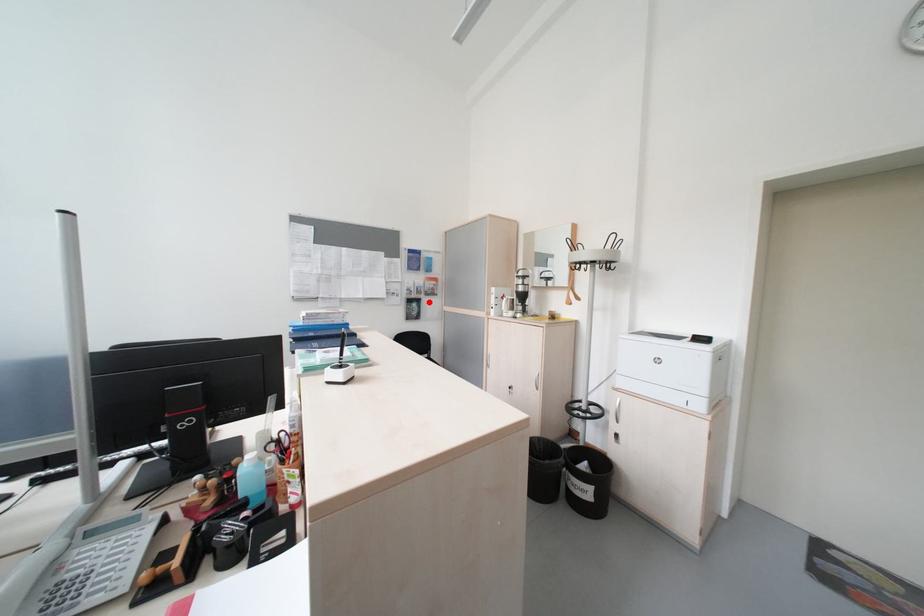
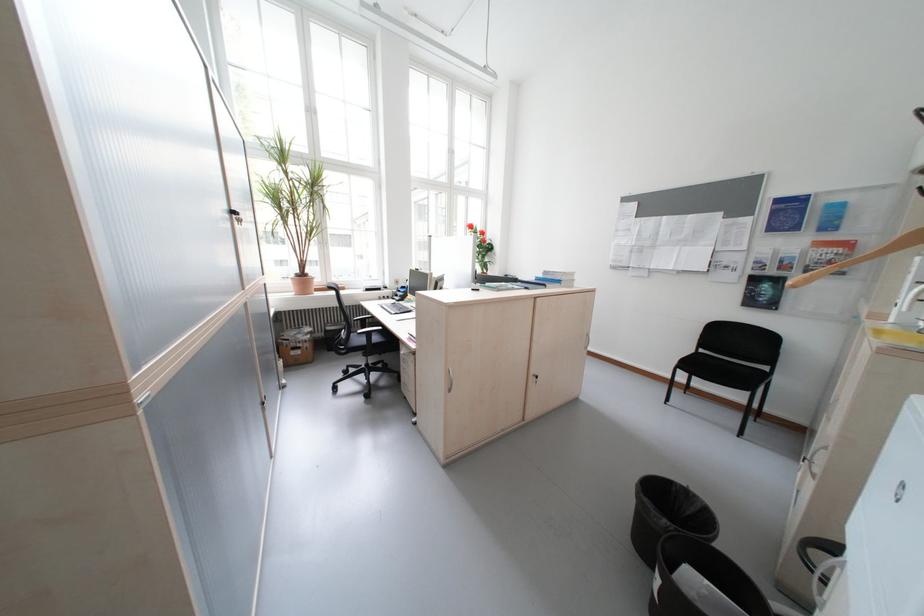
Question: I am providing you with two images of the same scene from different viewpoints. Given a red point in image1, look at the same physical point in image2. Is it:

Choices:
 (A) Closer to the viewpoint
 (B) Farther from the viewpoint

Answer: (B)